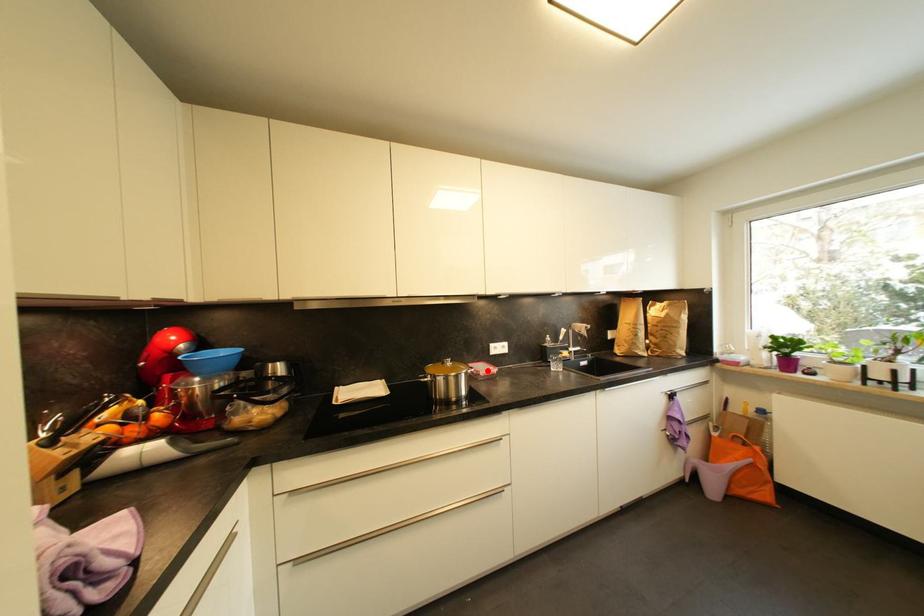
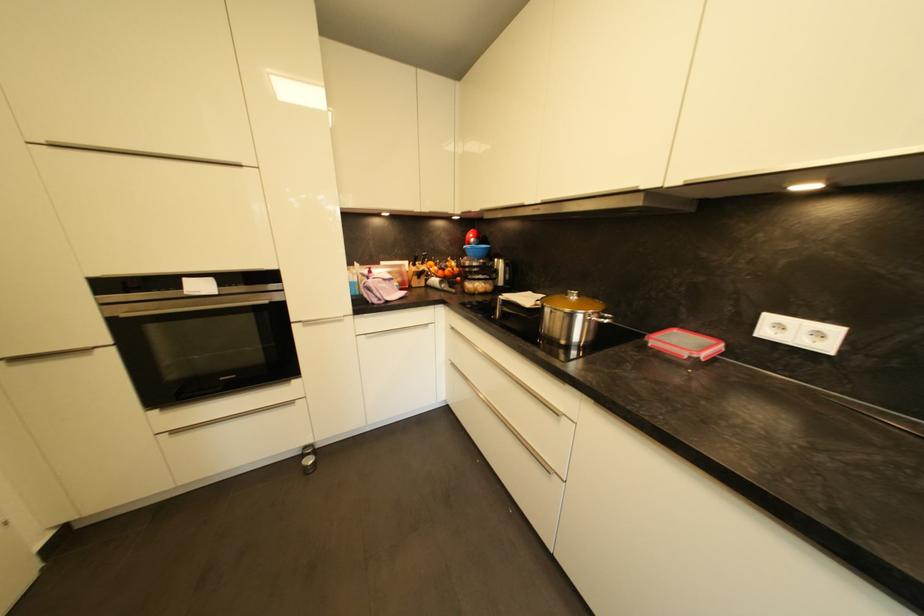
Question: A red point is marked in image1. In image2, is the corresponding 3D point closer to the camera or farther? Reply with the corresponding letter.

Choices:
 (A) The corresponding 3D point is closer.
 (B) The corresponding 3D point is farther.

Answer: (A)